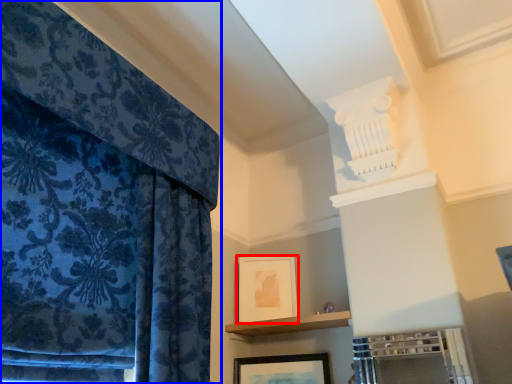
Question: Which of the following is the farthest to the observer, picture frame (highlighted by a red box) or curtain (highlighted by a blue box)?

Choices:
 (A) picture frame
 (B) curtain

Answer: (A)